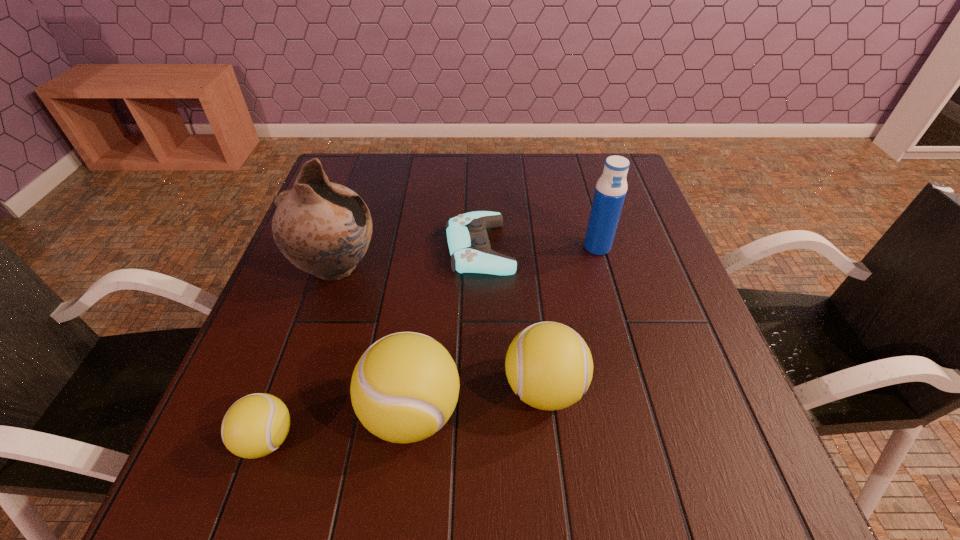
Locate an element on the screen. blank space located on the back of the second tennis ball from left to right is located at coordinates (427, 278).

You are a GUI agent. You are given a task and a screenshot of the screen. Output one action in this format:
    pyautogui.click(x=<x>, y=<y>)
    Task: Click on the vacant space located 0.170m on the back of the second shortest tennis ball
    The image size is (960, 540).
    Given the screenshot: What is the action you would take?
    pyautogui.click(x=533, y=292)

At what (x,y) coordinates should I click in order to perform the action: click on vacant space located on the left of the shortest object. Please return your answer as a coordinate pair (x, y). Looking at the image, I should click on (303, 248).

Find the location of a particular element. This screenshot has height=540, width=960. vacant space situated 0.400m from the spout of the pottery is located at coordinates (550, 268).

Identify the location of vacant area situated 0.400m on the left of the second tallest object. (422, 247).

Where is `tennis ball that is at the left edge`? This screenshot has width=960, height=540. tennis ball that is at the left edge is located at coordinates (256, 425).

Image resolution: width=960 pixels, height=540 pixels. In order to click on pottery located at the left edge in this screenshot , I will do `click(323, 228)`.

You are a GUI agent. You are given a task and a screenshot of the screen. Output one action in this format:
    pyautogui.click(x=<x>, y=<y>)
    Task: Click on the object present at the right edge
    This screenshot has width=960, height=540.
    Given the screenshot: What is the action you would take?
    click(611, 188)

Identify the location of object present at the near left corner. This screenshot has width=960, height=540. (256, 425).

This screenshot has width=960, height=540. Identify the location of free space at the far edge of the desktop. (573, 165).